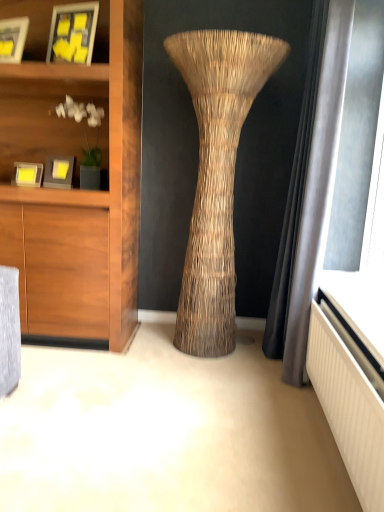
Question: Is the position of matte black picture frame at upper left, the third picture frame positioned from the bottom, less distant than that of matte gray picture frame at left, which is the second picture frame in bottom-to-top order?

Choices:
 (A) no
 (B) yes

Answer: (B)

Question: Is matte black picture frame at upper left, the third picture frame positioned from the bottom, not close to matte gray picture frame at left, which is the second picture frame in bottom-to-top order?

Choices:
 (A) yes
 (B) no

Answer: (B)

Question: Can you confirm if matte black picture frame at upper left, which ranks as the second picture frame in top-to-bottom order, is smaller than matte gray picture frame at left, arranged as the 3th picture frame when viewed from the top?

Choices:
 (A) no
 (B) yes

Answer: (A)

Question: From a real-world perspective, is matte black picture frame at upper left, the third picture frame positioned from the bottom, beneath matte gray picture frame at left, arranged as the 3th picture frame when viewed from the top?

Choices:
 (A) yes
 (B) no

Answer: (B)

Question: Considering the relative sizes of matte black picture frame at upper left, the third picture frame positioned from the bottom, and matte gray picture frame at left, arranged as the 3th picture frame when viewed from the top, in the image provided, is matte black picture frame at upper left, the third picture frame positioned from the bottom, wider than matte gray picture frame at left, arranged as the 3th picture frame when viewed from the top,?

Choices:
 (A) yes
 (B) no

Answer: (B)

Question: From a real-world perspective, is matte black picture frame at upper left, the third picture frame positioned from the bottom, on top of matte gray picture frame at left, which is the second picture frame in bottom-to-top order?

Choices:
 (A) no
 (B) yes

Answer: (B)

Question: Can you confirm if matte yellow picture frame at left, arranged as the 1th picture frame when ordered from the bottom, is wider than matte black picture frame at upper left, which ranks as the second picture frame in top-to-bottom order?

Choices:
 (A) yes
 (B) no

Answer: (B)

Question: Is matte yellow picture frame at left, the fourth picture frame positioned from the top, oriented towards matte black picture frame at upper left, which ranks as the second picture frame in top-to-bottom order?

Choices:
 (A) no
 (B) yes

Answer: (A)

Question: Considering the relative sizes of matte yellow picture frame at left, the fourth picture frame positioned from the top, and matte black picture frame at upper left, the third picture frame positioned from the bottom, in the image provided, is matte yellow picture frame at left, the fourth picture frame positioned from the top, taller than matte black picture frame at upper left, the third picture frame positioned from the bottom,?

Choices:
 (A) yes
 (B) no

Answer: (B)

Question: Can you confirm if matte yellow picture frame at left, the fourth picture frame positioned from the top, is thinner than matte black picture frame at upper left, which ranks as the second picture frame in top-to-bottom order?

Choices:
 (A) yes
 (B) no

Answer: (A)

Question: Considering the relative sizes of matte yellow picture frame at left, arranged as the 1th picture frame when ordered from the bottom, and matte black picture frame at upper left, the third picture frame positioned from the bottom, in the image provided, is matte yellow picture frame at left, arranged as the 1th picture frame when ordered from the bottom, shorter than matte black picture frame at upper left, the third picture frame positioned from the bottom,?

Choices:
 (A) no
 (B) yes

Answer: (B)

Question: Would you say matte black picture frame at upper left, the third picture frame positioned from the bottom, is part of matte yellow picture frame at left, arranged as the 1th picture frame when ordered from the bottom,'s contents?

Choices:
 (A) no
 (B) yes

Answer: (A)

Question: From the image's perspective, would you say matte yellow paper at upper left, the first picture frame viewed from the top, is positioned over matte black picture frame at upper left, which ranks as the second picture frame in top-to-bottom order?

Choices:
 (A) no
 (B) yes

Answer: (B)